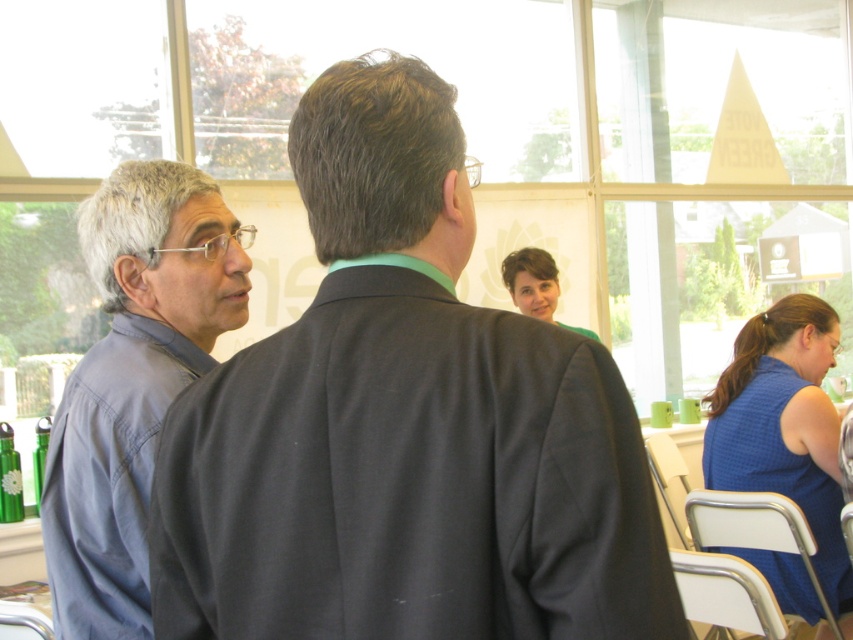
Question: Can you confirm if matte gray shirt at left is wider than blue textured dress at lower right?

Choices:
 (A) yes
 (B) no

Answer: (A)

Question: Which of the following is the farthest from the observer?

Choices:
 (A) matte gray shirt at left
 (B) blue cotton shirt at left
 (C) matte green shirt at center

Answer: (C)

Question: Which point is closer to the camera taking this photo?

Choices:
 (A) (817, 321)
 (B) (202, 269)

Answer: (B)

Question: Where is matte gray shirt at left located in relation to matte green shirt at center in the image?

Choices:
 (A) above
 (B) below

Answer: (B)

Question: Which of the following is the closest to the observer?

Choices:
 (A) matte green shirt at center
 (B) blue textured dress at lower right

Answer: (B)

Question: Can you confirm if matte gray shirt at left is positioned below blue cotton shirt at left?

Choices:
 (A) yes
 (B) no

Answer: (B)